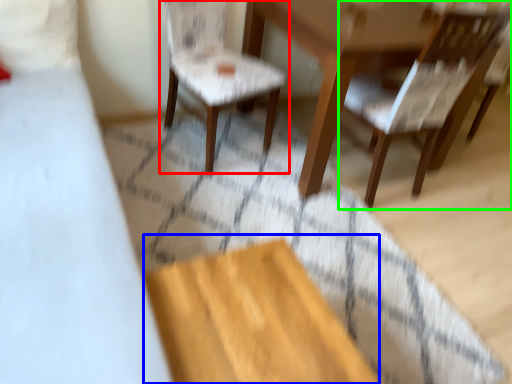
Question: Which object is the farthest from chair (highlighted by a red box)? Choose among these: plywood (highlighted by a blue box) or chair (highlighted by a green box).

Choices:
 (A) plywood
 (B) chair

Answer: (A)